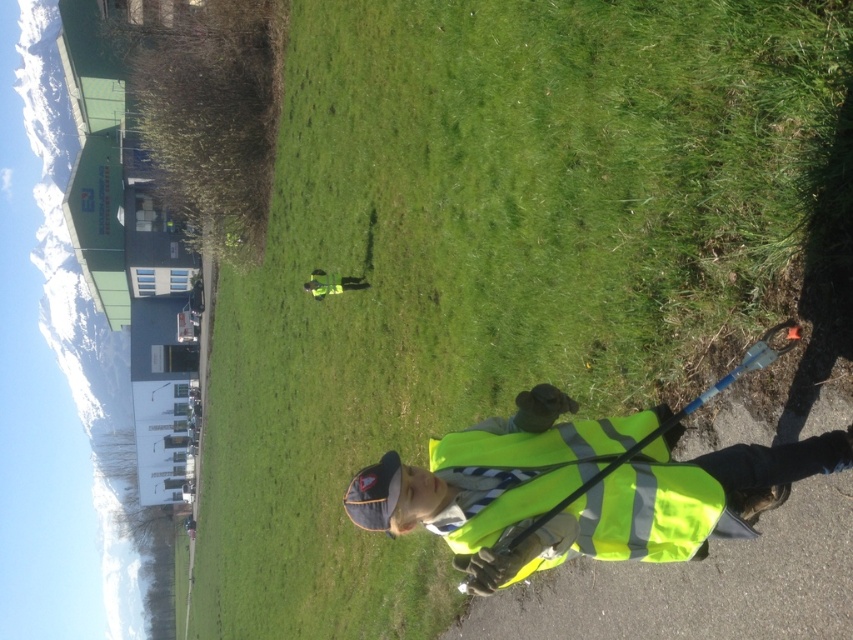
Is high-visibility yellow vest at center smaller than high-visibility fabric safety vest at center?

Actually, high-visibility yellow vest at center might be larger than high-visibility fabric safety vest at center.

Is point (651, 520) closer to viewer compared to point (625, 419)?

That is True.

I want to click on high-visibility yellow vest at center, so [x=576, y=490].

Can you confirm if high-visibility fabric safety vest at center is positioned below yellow reflective vest at center?

Correct, high-visibility fabric safety vest at center is located below yellow reflective vest at center.

Identify the location of high-visibility fabric safety vest at center. This screenshot has width=853, height=640. (521, 472).

In the scene shown: Is high-visibility yellow vest at center closer to camera compared to yellow reflective vest at center?

Yes, high-visibility yellow vest at center is in front of yellow reflective vest at center.

Which is more to the right, high-visibility yellow vest at center or yellow reflective vest at center?

From the viewer's perspective, high-visibility yellow vest at center appears more on the right side.

The width and height of the screenshot is (853, 640). Identify the location of high-visibility yellow vest at center. tap(576, 490).

Locate an element on the screen. The image size is (853, 640). high-visibility yellow vest at center is located at coordinates (576, 490).